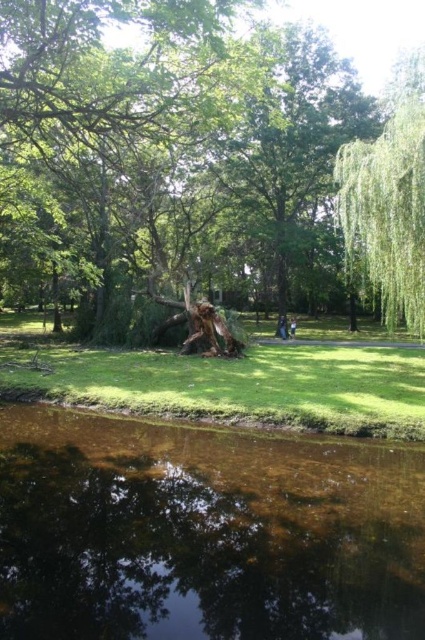
You are a hiker who wants to cross from the clear water at lower center to the dark blue fabric at center. Can you safely walk between them without getting wet?

The clear water at lower center and dark blue fabric at center are 22.57 meters apart. Since the distance is quite large, you might need to find another path or use a bridge to cross safely without getting wet.

You are a park visitor standing at the entrance of the park. You see the rough bark tree stump at center. Can you estimate its location using coordinates?

The rough bark tree stump at center is located at point (172,156).